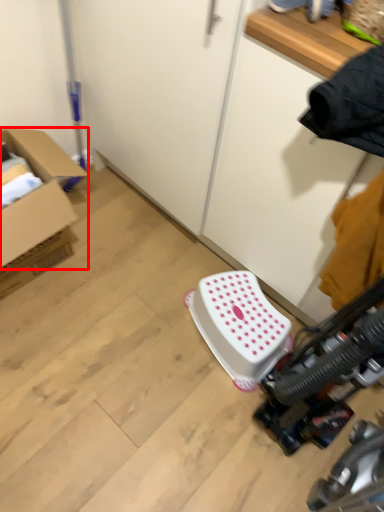
Question: Observing the image, what is the correct spatial positioning of box (annotated by the red box) in reference to stool?

Choices:
 (A) left
 (B) right

Answer: (A)